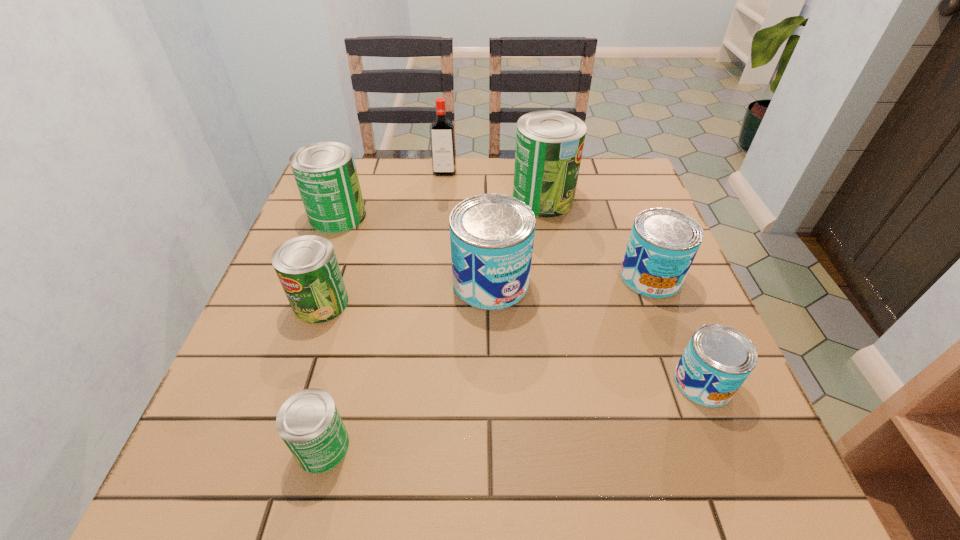
At what (x,y) coordinates should I click in order to perform the action: click on vodka at the far edge. Please return your answer as a coordinate pair (x, y). Image resolution: width=960 pixels, height=540 pixels. Looking at the image, I should click on (442, 133).

At what (x,y) coordinates should I click in order to perform the action: click on object at the near edge. Please return your answer as a coordinate pair (x, y). The height and width of the screenshot is (540, 960). Looking at the image, I should click on (309, 423).

This screenshot has height=540, width=960. What are the coordinates of `object located at the far left corner` in the screenshot? It's located at (325, 172).

At what (x,y) coordinates should I click in order to perform the action: click on vacant area at the far edge. Please return your answer as a coordinate pair (x, y). Image resolution: width=960 pixels, height=540 pixels. Looking at the image, I should click on (585, 204).

Identify the location of blank space at the near edge of the desktop. (564, 480).

You are a GUI agent. You are given a task and a screenshot of the screen. Output one action in this format:
    pyautogui.click(x=<x>, y=<y>)
    Task: Click on the vacant region at the left edge of the desktop
    The height and width of the screenshot is (540, 960).
    Given the screenshot: What is the action you would take?
    pyautogui.click(x=228, y=383)

I want to click on free location at the right edge, so click(674, 352).

The height and width of the screenshot is (540, 960). In order to click on free space at the far right corner in this screenshot , I will do `click(613, 194)`.

You are a GUI agent. You are given a task and a screenshot of the screen. Output one action in this format:
    pyautogui.click(x=<x>, y=<y>)
    Task: Click on the free spot between the biggest blue can and the nearest object
    This screenshot has width=960, height=540.
    Given the screenshot: What is the action you would take?
    (x=407, y=364)

This screenshot has width=960, height=540. What are the coordinates of `free spot between the farthest object and the nearest can` in the screenshot? It's located at (384, 309).